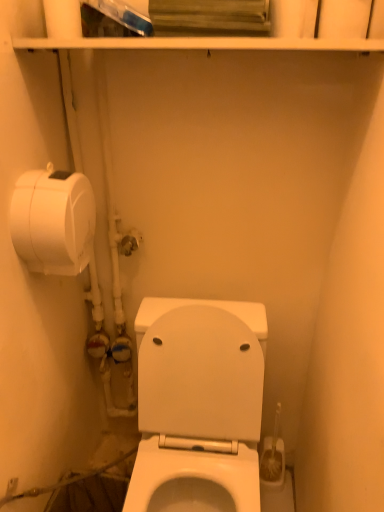
Question: Can you confirm if white matte toilet paper at left is bigger than white glossy toilet at center?

Choices:
 (A) no
 (B) yes

Answer: (A)

Question: Is white glossy toilet at center surrounded by white matte toilet paper at left?

Choices:
 (A) no
 (B) yes

Answer: (A)

Question: From a real-world perspective, is white matte toilet paper at left physically below white glossy toilet at center?

Choices:
 (A) yes
 (B) no

Answer: (B)

Question: From the image's perspective, is white matte toilet paper at left above white glossy toilet at center?

Choices:
 (A) yes
 (B) no

Answer: (A)

Question: Would you say white matte toilet paper at left is outside white glossy toilet at center?

Choices:
 (A) no
 (B) yes

Answer: (B)

Question: Does white matte toilet paper at left lie behind white glossy toilet at center?

Choices:
 (A) yes
 (B) no

Answer: (A)

Question: From a real-world perspective, is white glossy toilet at center below white matte toilet paper at left?

Choices:
 (A) yes
 (B) no

Answer: (A)

Question: Does white glossy toilet at center have a smaller size compared to white matte toilet paper at left?

Choices:
 (A) yes
 (B) no

Answer: (B)

Question: Considering the relative sizes of white glossy toilet at center and white matte toilet paper at left in the image provided, is white glossy toilet at center shorter than white matte toilet paper at left?

Choices:
 (A) yes
 (B) no

Answer: (B)

Question: Is white glossy toilet at center at the right side of white matte toilet paper at left?

Choices:
 (A) yes
 (B) no

Answer: (A)

Question: From a real-world perspective, is white glossy toilet at center located higher than white matte toilet paper at left?

Choices:
 (A) yes
 (B) no

Answer: (B)

Question: Can you confirm if white glossy toilet at center is bigger than white matte toilet paper at left?

Choices:
 (A) no
 (B) yes

Answer: (B)

Question: From a real-world perspective, is white glossy toilet at center above or below white matte toilet paper at left?

Choices:
 (A) below
 (B) above

Answer: (A)